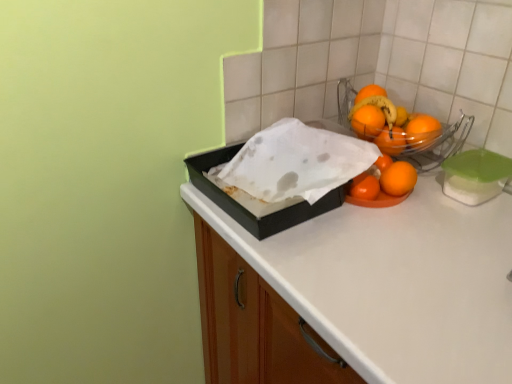
Describe the element at coordinates (368, 121) in the screenshot. I see `orange matte at upper right, arranged as the first orange when viewed from the top` at that location.

This screenshot has width=512, height=384. Find the location of `orange matte at upper right, the 4th orange positioned from the bottom`. orange matte at upper right, the 4th orange positioned from the bottom is located at coordinates [368, 121].

I want to click on orange matte at right, which ranks as the second orange in bottom-to-top order, so click(x=391, y=140).

In order to click on orange matte at right, arranged as the 3th orange when ordered from the bottom in this screenshot , I will do `click(422, 130)`.

What do you see at coordinates (377, 107) in the screenshot? I see `shiny orange oranges at upper right` at bounding box center [377, 107].

What do you see at coordinates (384, 185) in the screenshot? The width and height of the screenshot is (512, 384). I see `orange matte/orange at center, the 1th orange from the bottom` at bounding box center [384, 185].

Where is `orange matte at upper right, the 4th orange positioned from the bottom`? This screenshot has width=512, height=384. orange matte at upper right, the 4th orange positioned from the bottom is located at coordinates (368, 121).

Based on their sizes in the image, would you say orange matte/orange at center, the 1th orange from the bottom, is bigger or smaller than orange matte at upper right, arranged as the first orange when viewed from the top?

In the image, orange matte/orange at center, the 1th orange from the bottom, appears to be larger than orange matte at upper right, arranged as the first orange when viewed from the top.

How far apart are orange matte/orange at center, which appears as the 4th orange when viewed from the top, and orange matte at upper right, arranged as the first orange when viewed from the top?

They are 4.98 inches apart.

From the image's perspective, is orange matte/orange at center, which appears as the 4th orange when viewed from the top, on top of orange matte at upper right, the 4th orange positioned from the bottom?

No, from the image's perspective, orange matte/orange at center, which appears as the 4th orange when viewed from the top, is not over orange matte at upper right, the 4th orange positioned from the bottom.

How different are the orientations of orange matte/orange at center, which appears as the 4th orange when viewed from the top, and orange matte at upper right, the 4th orange positioned from the bottom, in degrees?

They differ by 0.000503 degrees in their facing directions.

Is orange matte at right, which ranks as the second orange in bottom-to-top order, touching black matte box at center?

orange matte at right, which ranks as the second orange in bottom-to-top order, and black matte box at center are not in contact.

Could black matte box at center be considered to be inside orange matte at right, which ranks as the second orange in bottom-to-top order?

No.

From the image's perspective, is orange matte at right, marked as the third orange in a top-to-bottom arrangement, under black matte box at center?

No, from the image's perspective, orange matte at right, marked as the third orange in a top-to-bottom arrangement, is not beneath black matte box at center.

Between shiny orange oranges at upper right and orange matte at upper right, arranged as the first orange when viewed from the top, which one has less height?

orange matte at upper right, arranged as the first orange when viewed from the top.

Is shiny orange oranges at upper right in front of or behind orange matte at upper right, arranged as the first orange when viewed from the top, in the image?

shiny orange oranges at upper right is positioned farther from the viewer than orange matte at upper right, arranged as the first orange when viewed from the top.

Consider the image. From the image's perspective, which object appears higher, shiny orange oranges at upper right or orange matte at upper right, arranged as the first orange when viewed from the top?

shiny orange oranges at upper right.

Does shiny orange oranges at upper right appear on the right side of orange matte at upper right, the 4th orange positioned from the bottom?

Correct, you'll find shiny orange oranges at upper right to the right of orange matte at upper right, the 4th orange positioned from the bottom.

Is shiny orange oranges at upper right wider or thinner than black matte box at center?

Clearly, shiny orange oranges at upper right has less width compared to black matte box at center.

From the image's perspective, is shiny orange oranges at upper right beneath black matte box at center?

Actually, shiny orange oranges at upper right appears above black matte box at center in the image.

Is shiny orange oranges at upper right placed right next to black matte box at center?

No, shiny orange oranges at upper right is not in contact with black matte box at center.

The image size is (512, 384). What are the coordinates of `fruit lying behind the black matte box at center` in the screenshot? It's located at (377, 107).

Is black matte box at center directly adjacent to orange matte at right, which ranks as the second orange in bottom-to-top order?

No, black matte box at center is not with orange matte at right, which ranks as the second orange in bottom-to-top order.

How different are the orientations of black matte box at center and orange matte at right, which ranks as the second orange in bottom-to-top order, in degrees?

The angular difference between black matte box at center and orange matte at right, which ranks as the second orange in bottom-to-top order, is 2.2 degrees.

Consider the image. Based on their sizes in the image, would you say black matte box at center is bigger or smaller than orange matte at right, marked as the third orange in a top-to-bottom arrangement?

Considering their sizes, black matte box at center takes up more space than orange matte at right, marked as the third orange in a top-to-bottom arrangement.

Is orange matte at right, marked as the third orange in a top-to-bottom arrangement, far from orange matte at upper right, arranged as the first orange when viewed from the top?

No, orange matte at right, marked as the third orange in a top-to-bottom arrangement, is not far from orange matte at upper right, arranged as the first orange when viewed from the top.

Is orange matte at right, marked as the third orange in a top-to-bottom arrangement, thinner than orange matte at upper right, arranged as the first orange when viewed from the top?

Yes, orange matte at right, marked as the third orange in a top-to-bottom arrangement, is thinner than orange matte at upper right, arranged as the first orange when viewed from the top.

You are a GUI agent. You are given a task and a screenshot of the screen. Output one action in this format:
    pyautogui.click(x=<x>, y=<y>)
    Task: Click on the 2nd orange above when counting from the orange matte at right, marked as the third orange in a top-to-bottom arrangement (from the image's perspective)
    This screenshot has height=384, width=512.
    Given the screenshot: What is the action you would take?
    pyautogui.click(x=368, y=121)

From a real-world perspective, who is located lower, orange matte at right, which ranks as the second orange in bottom-to-top order, or orange matte at upper right, the 4th orange positioned from the bottom?

From a 3D spatial view, orange matte at right, which ranks as the second orange in bottom-to-top order, is below.

From the picture: Could you tell me if orange matte at upper right, arranged as the first orange when viewed from the top, is turned towards orange matte/orange at center, which appears as the 4th orange when viewed from the top?

No, orange matte at upper right, arranged as the first orange when viewed from the top, is not oriented towards orange matte/orange at center, which appears as the 4th orange when viewed from the top.

From the image's perspective, is orange matte at upper right, the 4th orange positioned from the bottom, above or below orange matte/orange at center, which appears as the 4th orange when viewed from the top?

orange matte at upper right, the 4th orange positioned from the bottom, is above orange matte/orange at center, which appears as the 4th orange when viewed from the top.

Is orange matte at upper right, arranged as the first orange when viewed from the top, positioned before orange matte/orange at center, which appears as the 4th orange when viewed from the top?

No, it is behind orange matte/orange at center, which appears as the 4th orange when viewed from the top.

The width and height of the screenshot is (512, 384). There is a orange matte at upper right, the 4th orange positioned from the bottom. Identify the location of the 3rd orange below it (from the image's perspective). (384, 185).

Identify the location of box below the orange matte at right, which ranks as the second orange in bottom-to-top order (from a real-world perspective). (246, 209).

Which object lies further to the anchor point orange matte/orange at center, which appears as the 4th orange when viewed from the top, shiny orange oranges at upper right or orange matte at right, marked as the second orange in a top-to-bottom arrangement?

shiny orange oranges at upper right is positioned further to the anchor orange matte/orange at center, which appears as the 4th orange when viewed from the top.

Based on the photo, when comparing their distances from orange matte at right, marked as the third orange in a top-to-bottom arrangement, does shiny orange oranges at upper right or orange matte at upper right, arranged as the first orange when viewed from the top, seem closer?

orange matte at upper right, arranged as the first orange when viewed from the top, lies closer to orange matte at right, marked as the third orange in a top-to-bottom arrangement, than the other object.

Estimate the real-world distances between objects in this image. Which object is further from orange matte/orange at center, the 1th orange from the bottom, orange matte at right, arranged as the 3th orange when ordered from the bottom, or orange matte at right, which ranks as the second orange in bottom-to-top order?

orange matte at right, arranged as the 3th orange when ordered from the bottom, is further to orange matte/orange at center, the 1th orange from the bottom.

Based on their spatial positions, is black matte box at center or shiny orange oranges at upper right further from orange matte at right, which ranks as the second orange in bottom-to-top order?

black matte box at center lies further to orange matte at right, which ranks as the second orange in bottom-to-top order, than the other object.

From the image, which object appears to be nearer to orange matte at right, which ranks as the second orange in bottom-to-top order, orange matte at right, arranged as the 3th orange when ordered from the bottom, or shiny orange oranges at upper right?

The object closer to orange matte at right, which ranks as the second orange in bottom-to-top order, is orange matte at right, arranged as the 3th orange when ordered from the bottom.

Looking at the image, which one is located further to orange matte at right, marked as the second orange in a top-to-bottom arrangement, shiny orange oranges at upper right or orange matte/orange at center, which appears as the 4th orange when viewed from the top?

Based on the image, orange matte/orange at center, which appears as the 4th orange when viewed from the top, appears to be further to orange matte at right, marked as the second orange in a top-to-bottom arrangement.

Looking at the image, which one is located further to orange matte/orange at center, which appears as the 4th orange when viewed from the top, orange matte at right, marked as the third orange in a top-to-bottom arrangement, or shiny orange oranges at upper right?

shiny orange oranges at upper right.

Looking at the image, which one is located closer to orange matte at right, marked as the second orange in a top-to-bottom arrangement, orange matte at upper right, arranged as the first orange when viewed from the top, or orange matte at right, which ranks as the second orange in bottom-to-top order?

orange matte at right, which ranks as the second orange in bottom-to-top order, is closer to orange matte at right, marked as the second orange in a top-to-bottom arrangement.

You are a GUI agent. You are given a task and a screenshot of the screen. Output one action in this format:
    pyautogui.click(x=<x>, y=<y>)
    Task: Click on the fruit between orange matte at upper right, arranged as the first orange when viewed from the top, and orange matte at right, arranged as the 3th orange when ordered from the bottom, from left to right
    
    Given the screenshot: What is the action you would take?
    pyautogui.click(x=377, y=107)

In order to click on orange between orange matte at right, marked as the second orange in a top-to-bottom arrangement, and orange matte/orange at center, the 1th orange from the bottom, in the up-down direction in this screenshot , I will do pyautogui.click(x=391, y=140).

Where is `fruit situated between black matte box at center and orange matte at right, marked as the third orange in a top-to-bottom arrangement, from left to right`? This screenshot has width=512, height=384. fruit situated between black matte box at center and orange matte at right, marked as the third orange in a top-to-bottom arrangement, from left to right is located at coordinates (377, 107).

The height and width of the screenshot is (384, 512). I want to click on fruit between black matte box at center and orange matte/orange at center, the 1th orange from the bottom, so click(377, 107).